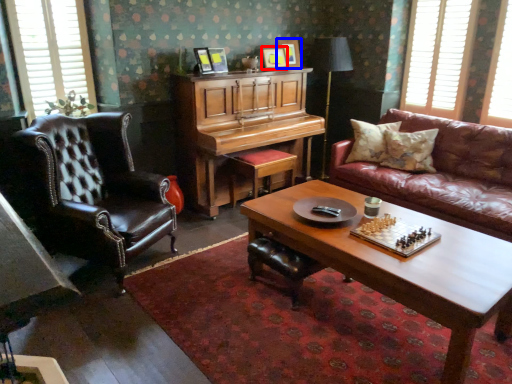
Question: Which point is closer to the camera, picture frame (highlighted by a red box) or picture frame (highlighted by a blue box)?

Choices:
 (A) picture frame
 (B) picture frame

Answer: (A)